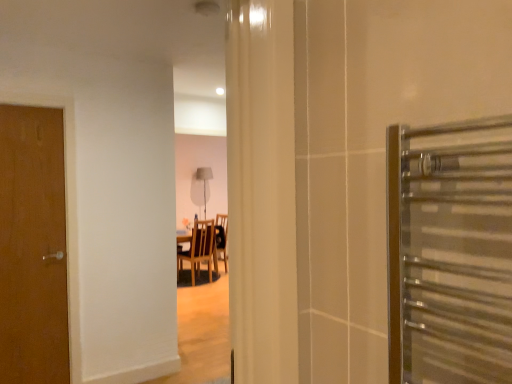
Question: Does wooden chair at center appear on the right side of brown wood door at left?

Choices:
 (A) no
 (B) yes

Answer: (B)

Question: Does wooden chair at center have a lesser width compared to brown wood door at left?

Choices:
 (A) no
 (B) yes

Answer: (A)

Question: Can you confirm if wooden chair at center is smaller than brown wood door at left?

Choices:
 (A) yes
 (B) no

Answer: (B)

Question: From a real-world perspective, is wooden chair at center beneath brown wood door at left?

Choices:
 (A) no
 (B) yes

Answer: (B)

Question: Considering the relative positions of wooden chair at center and brown wood door at left in the image provided, is wooden chair at center to the left of brown wood door at left from the viewer's perspective?

Choices:
 (A) no
 (B) yes

Answer: (A)

Question: Can we say wooden chair at center lies outside brown wood door at left?

Choices:
 (A) yes
 (B) no

Answer: (A)

Question: Does brown wood door at left have a smaller size compared to wooden chair at center?

Choices:
 (A) no
 (B) yes

Answer: (B)

Question: Does brown wood door at left have a lesser width compared to wooden chair at center?

Choices:
 (A) no
 (B) yes

Answer: (B)

Question: Could wooden chair at center be considered to be inside brown wood door at left?

Choices:
 (A) yes
 (B) no

Answer: (B)

Question: Is brown wood door at left to the right of wooden chair at center from the viewer's perspective?

Choices:
 (A) no
 (B) yes

Answer: (A)

Question: From the image's perspective, is brown wood door at left above wooden chair at center?

Choices:
 (A) no
 (B) yes

Answer: (B)

Question: Could you tell me if brown wood door at left is facing wooden chair at center?

Choices:
 (A) yes
 (B) no

Answer: (B)

Question: Looking at the image, does wooden chair at center seem bigger or smaller compared to brown wood door at left?

Choices:
 (A) big
 (B) small

Answer: (A)